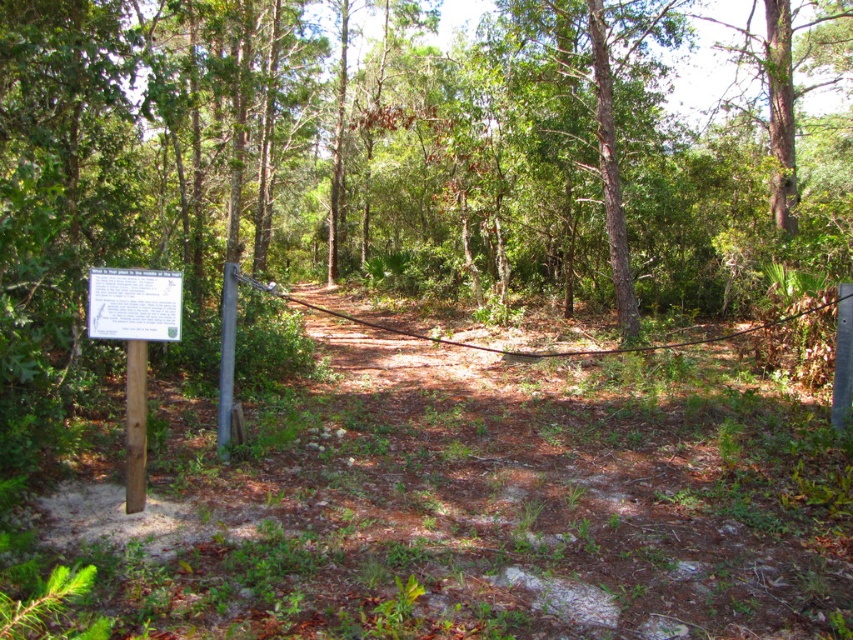
Consider the image. You are a hiker following the brown dirt track at center and want to read the white paper sign at left. Which direction should you move relative to the track to reach the sign?

The white paper sign at left is on the left side of the brown dirt track at center, so you should move to the left to reach it.

You are standing on the brown dirt track at center. There is a point at coordinates (x=485, y=506). Is that point on the dirt track or somewhere else?

The point at coordinates (x=485, y=506) is on the brown dirt track at center.

You are a hiker trying to follow the dirt path in the forest. You notice the brown dirt track at center and the white paper sign at left. Which one takes up more area in the image?

The white paper sign at left takes up more area in the image than the brown dirt track at center because the brown dirt track at center occupies less space than white paper sign at left.